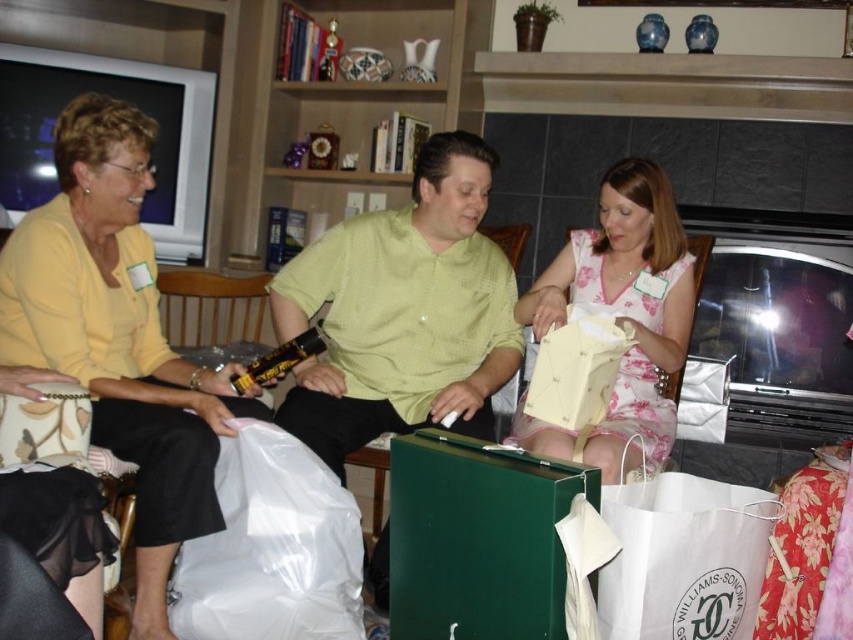
Question: Is transparent plastic bag at lower left to the right of floral fabric dress at center from the viewer's perspective?

Choices:
 (A) yes
 (B) no

Answer: (B)

Question: Which of the following is the closest to the observer?

Choices:
 (A) (131, 637)
 (B) (277, 509)
 (C) (695, 492)

Answer: (C)

Question: Which point appears farthest from the camera in this image?

Choices:
 (A) (163, 531)
 (B) (252, 420)
 (C) (699, 612)

Answer: (B)

Question: Which point is closer to the camera?

Choices:
 (A) white paper shopping bag at lower right
 (B) yellow matte shirt at upper left
 (C) floral fabric dress at center
 (D) green textured shirt at center

Answer: (A)

Question: Does yellow matte shirt at upper left appear under white paper shopping bag at lower right?

Choices:
 (A) no
 (B) yes

Answer: (A)

Question: Observing the image, what is the correct spatial positioning of green textured shirt at center in reference to white paper bag at center?

Choices:
 (A) right
 (B) left

Answer: (B)